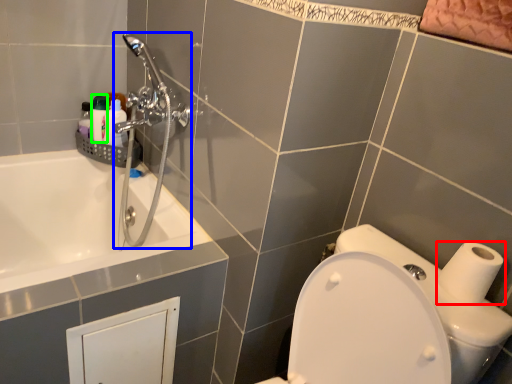
Question: Estimate the real-world distances between objects in this image. Which object is farther from toilet paper (highlighted by a red box), shower (highlighted by a blue box) or toiletry (highlighted by a green box)?

Choices:
 (A) shower
 (B) toiletry

Answer: (B)